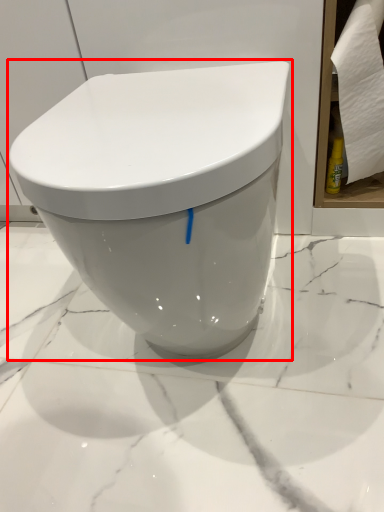
Question: From the image's perspective, where is toilet (annotated by the red box) located relative to toilet paper?

Choices:
 (A) above
 (B) below

Answer: (B)